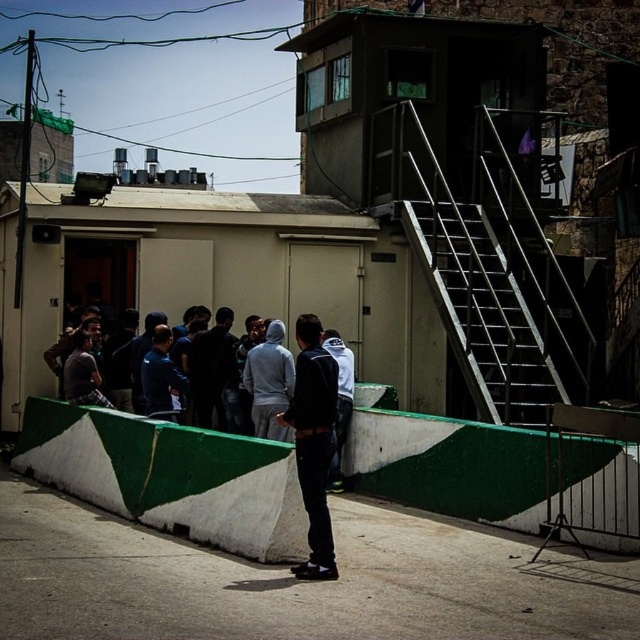
You are standing at the point marked by the coordinate point [211,369], which corresponds to the dark blue hoodie at center. Looking towards the beige building with a green roof, can you see the surveillance camera mounted on its roof?

The dark blue hoodie at center is located at point [211,369]. Since the beige building with a green roof has a surveillance camera mounted on its roof, and the building is in front of the concrete barrier where the hoodie is positioned, the camera should be visible from that point.

You are a delivery person with a cart that is 2 meters wide. You need to move from the dark blue jeans at center to the dark blue hoodie at center. Is there enough space between them for your cart to pass through?

The distance between the dark blue jeans at center and the dark blue hoodie at center is 4.74 meters. Since your cart is 2 meters wide, there is sufficient space for the cart to pass through as the distance is greater than the cart width.